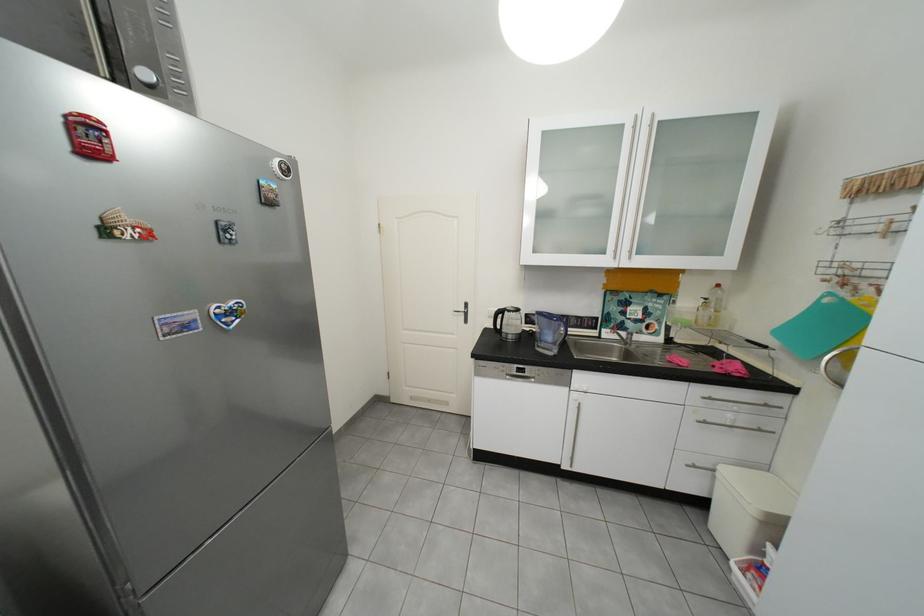
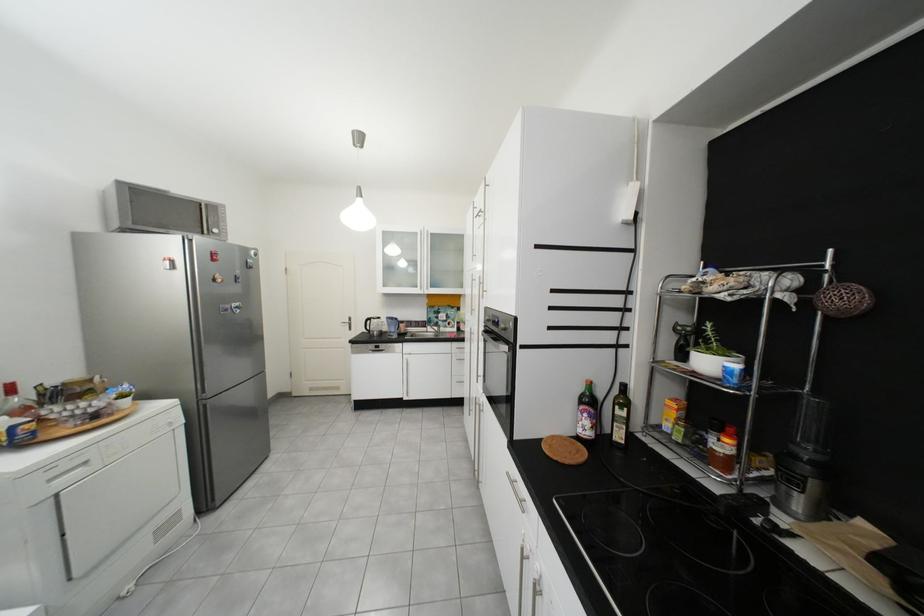
Find the pixel in the second image that matches point (478, 315) in the first image.

(361, 325)